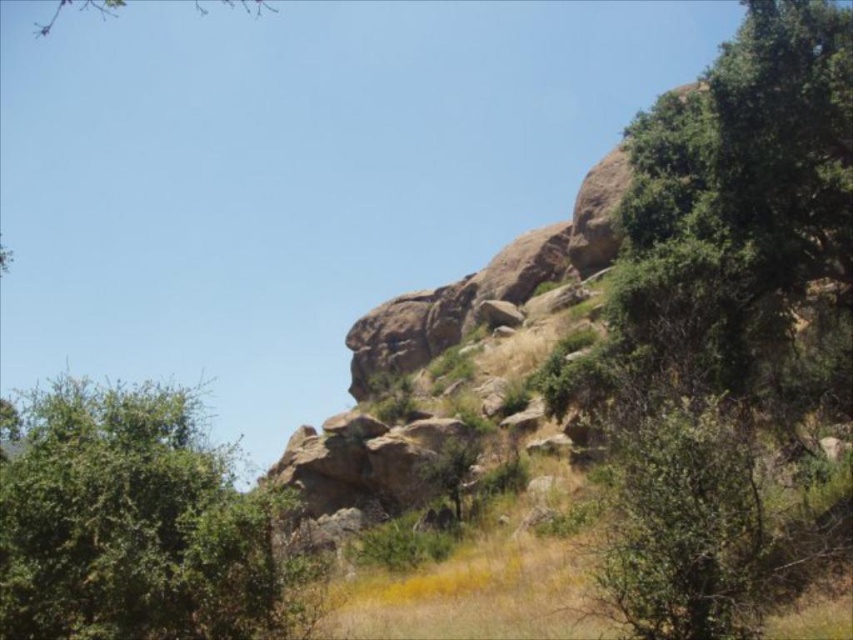
Between green leafy tree at upper right and green leafy tree at upper left, which one is positioned lower?

green leafy tree at upper right is lower down.

Which is behind, point (776, 337) or point (234, 4)?

Point (234, 4)

I want to click on green leafy tree at upper right, so click(x=735, y=228).

Is green leafy tree at upper right to the left of green leafy bush at left from the viewer's perspective?

Incorrect, green leafy tree at upper right is not on the left side of green leafy bush at left.

Is green leafy tree at upper right taller than green leafy bush at left?

Correct, green leafy tree at upper right is much taller as green leafy bush at left.

You are a GUI agent. You are given a task and a screenshot of the screen. Output one action in this format:
    pyautogui.click(x=<x>, y=<y>)
    Task: Click on the green leafy tree at upper right
    
    Given the screenshot: What is the action you would take?
    pyautogui.click(x=735, y=228)

At what (x,y) coordinates should I click in order to perform the action: click on green leafy tree at upper right. Please return your answer as a coordinate pair (x, y). Looking at the image, I should click on pos(735,228).

Can you confirm if green leafy bush at left is positioned above green leafy tree at upper left?

Actually, green leafy bush at left is below green leafy tree at upper left.

Who is more forward, (x=82, y=557) or (x=125, y=3)?

Point (x=82, y=557)

The image size is (853, 640). I want to click on green leafy bush at left, so click(x=132, y=525).